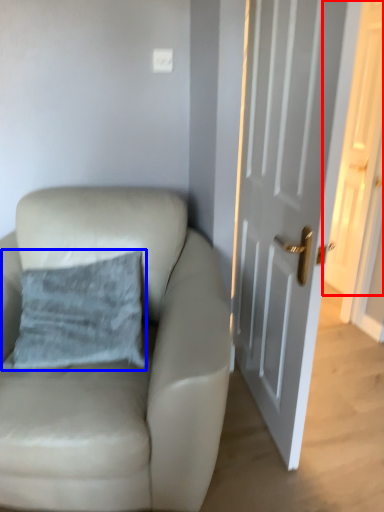
Question: Among these objects, which one is nearest to the camera, door (highlighted by a red box) or pillow (highlighted by a blue box)?

Choices:
 (A) door
 (B) pillow

Answer: (B)